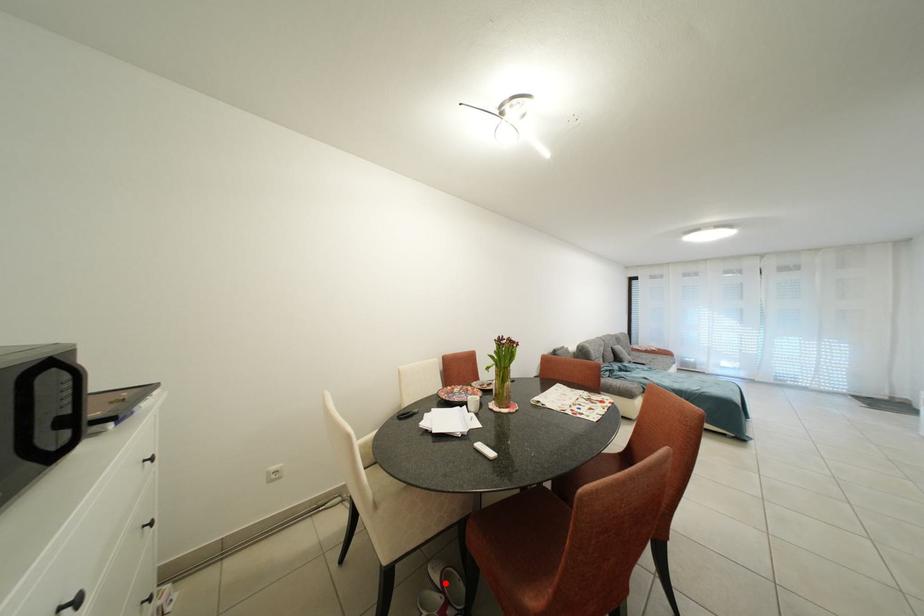
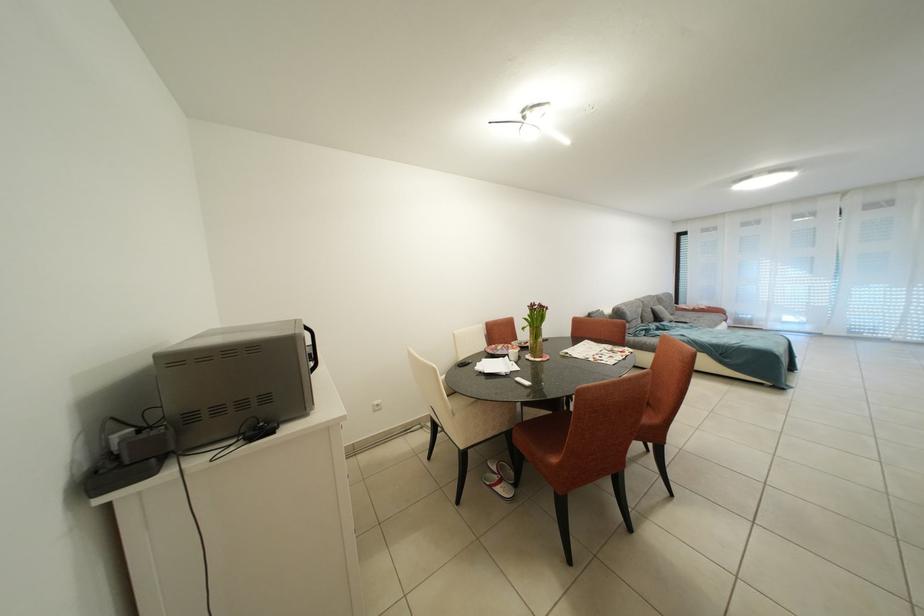
Find the pixel in the second image that matches the highlighted location in the first image.

(503, 472)